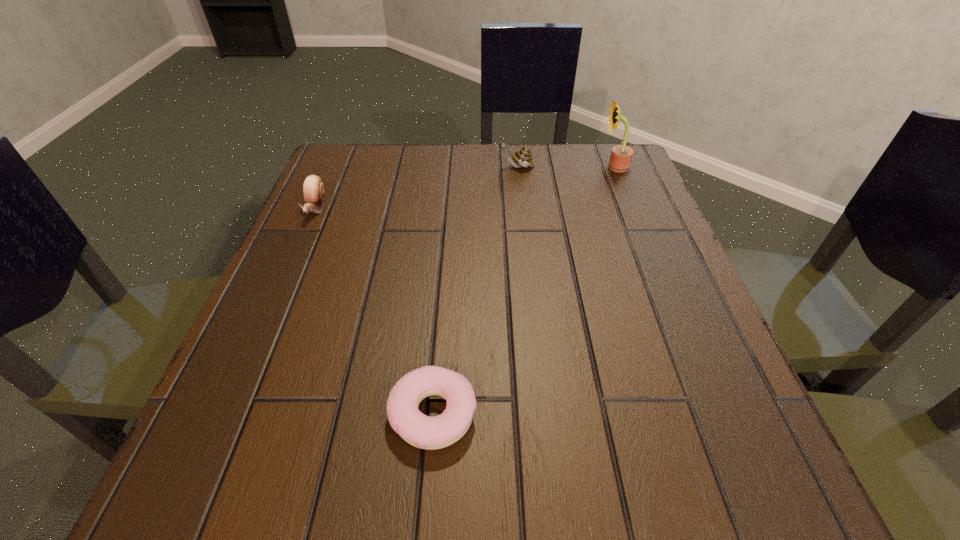
Find the location of a particular element. Image resolution: width=960 pixels, height=540 pixels. sunflower is located at coordinates (621, 155).

Where is `the rightmost object`? the rightmost object is located at coordinates (621, 155).

Where is `the third object from left to right`? the third object from left to right is located at coordinates (523, 158).

Identify the location of the farther escargot. (523, 158).

You are a GUI agent. You are given a task and a screenshot of the screen. Output one action in this format:
    pyautogui.click(x=<x>, y=<y>)
    Task: Click on the nearer escargot
    The width and height of the screenshot is (960, 540).
    Given the screenshot: What is the action you would take?
    pyautogui.click(x=313, y=188)

Find the location of a particular element. the third tallest object is located at coordinates (313, 188).

Locate an element on the screen. This screenshot has height=540, width=960. the second object from left to right is located at coordinates [x=421, y=431].

At what (x,y) coordinates should I click in order to perform the action: click on the shortest object. Please return your answer as a coordinate pair (x, y). The width and height of the screenshot is (960, 540). Looking at the image, I should click on (421, 431).

At what (x,y) coordinates should I click in order to perform the action: click on vacant space located 0.290m on the face of the sunflower. Please return your answer as a coordinate pair (x, y). This screenshot has height=540, width=960. Looking at the image, I should click on (477, 167).

Where is `vacant space positioned on the face of the sunflower`? vacant space positioned on the face of the sunflower is located at coordinates (443, 167).